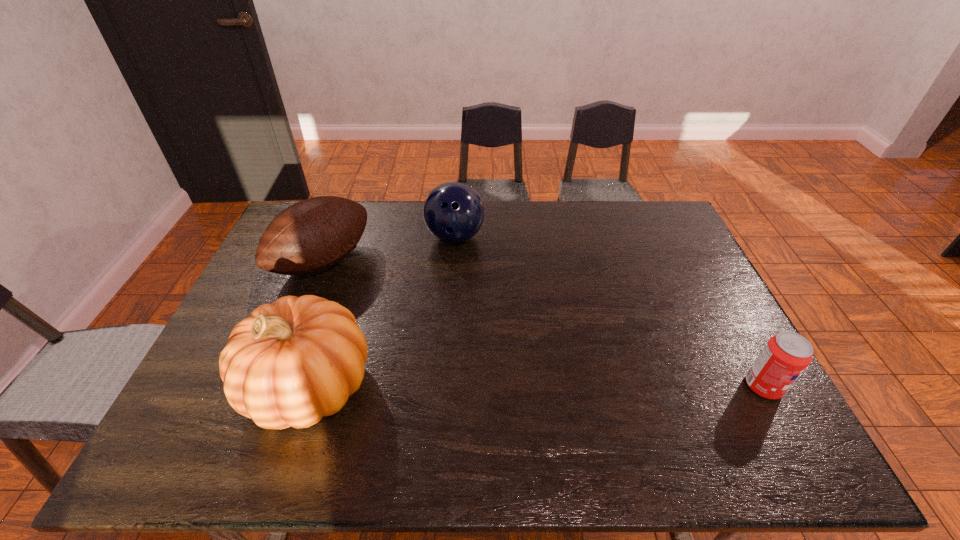
Where is `vacant region located on the surface of the bowling ball near the finger holes`? The height and width of the screenshot is (540, 960). vacant region located on the surface of the bowling ball near the finger holes is located at coordinates (481, 325).

Identify the location of vacant region located on the surface of the bowling ball near the finger holes. (479, 320).

You are a GUI agent. You are given a task and a screenshot of the screen. Output one action in this format:
    pyautogui.click(x=<x>, y=<y>)
    Task: Click on the football situated at the far edge
    Image resolution: width=960 pixels, height=540 pixels.
    Given the screenshot: What is the action you would take?
    pyautogui.click(x=312, y=235)

At what (x,y) coordinates should I click in order to perform the action: click on bowling ball located in the far edge section of the desktop. Please return your answer as a coordinate pair (x, y). The height and width of the screenshot is (540, 960). Looking at the image, I should click on (453, 212).

The height and width of the screenshot is (540, 960). In order to click on pumpkin present at the near edge in this screenshot , I will do `click(290, 363)`.

You are a GUI agent. You are given a task and a screenshot of the screen. Output one action in this format:
    pyautogui.click(x=<x>, y=<y>)
    Task: Click on the soda can that is at the near edge
    This screenshot has height=540, width=960.
    Given the screenshot: What is the action you would take?
    pyautogui.click(x=786, y=355)

The height and width of the screenshot is (540, 960). In order to click on pumpkin present at the left edge in this screenshot , I will do `click(290, 363)`.

The width and height of the screenshot is (960, 540). I want to click on football that is at the left edge, so click(x=312, y=235).

This screenshot has height=540, width=960. I want to click on object that is at the right edge, so click(786, 355).

Identify the location of object located at the far left corner. This screenshot has width=960, height=540. (312, 235).